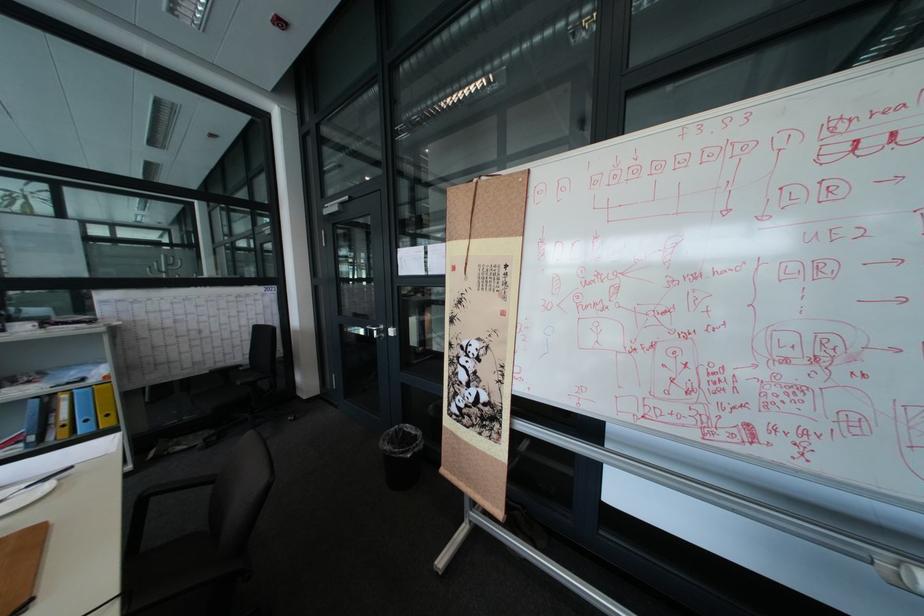
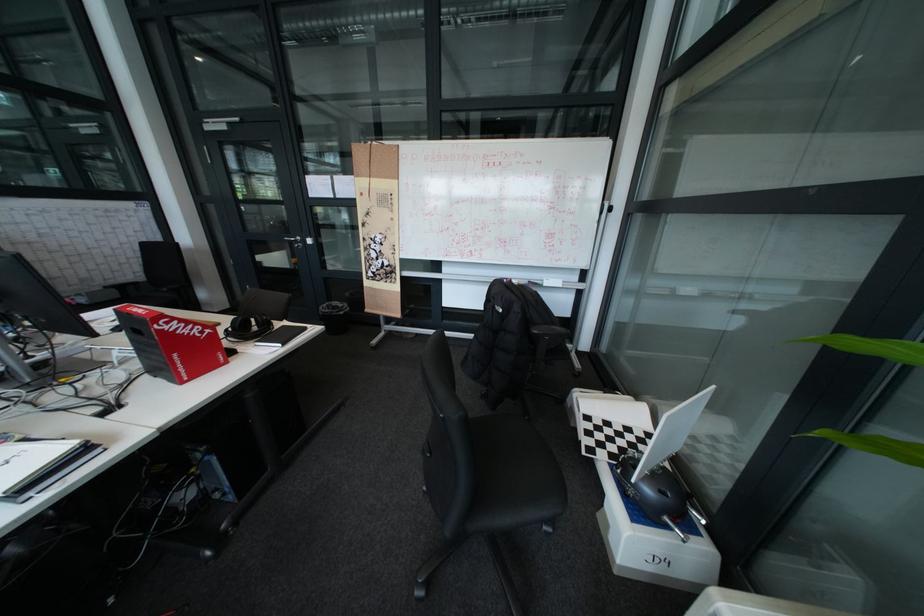
Question: In a continuous first-person perspective shot, in which direction is the camera moving?

Choices:
 (A) Left
 (B) Right
 (C) Forward
 (D) Backward

Answer: (D)